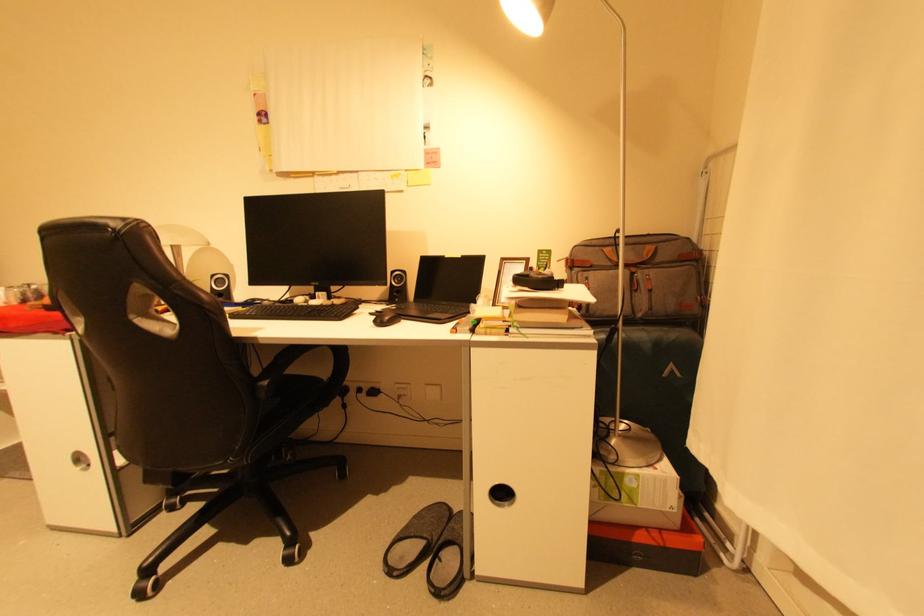
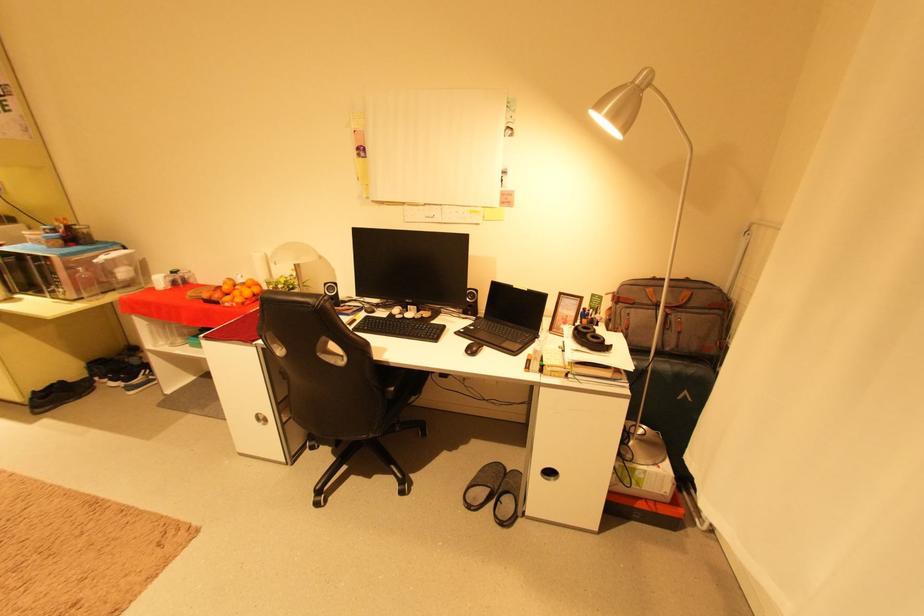
Find the pixel in the second image that matches pixel 429 545 in the first image.

(494, 492)